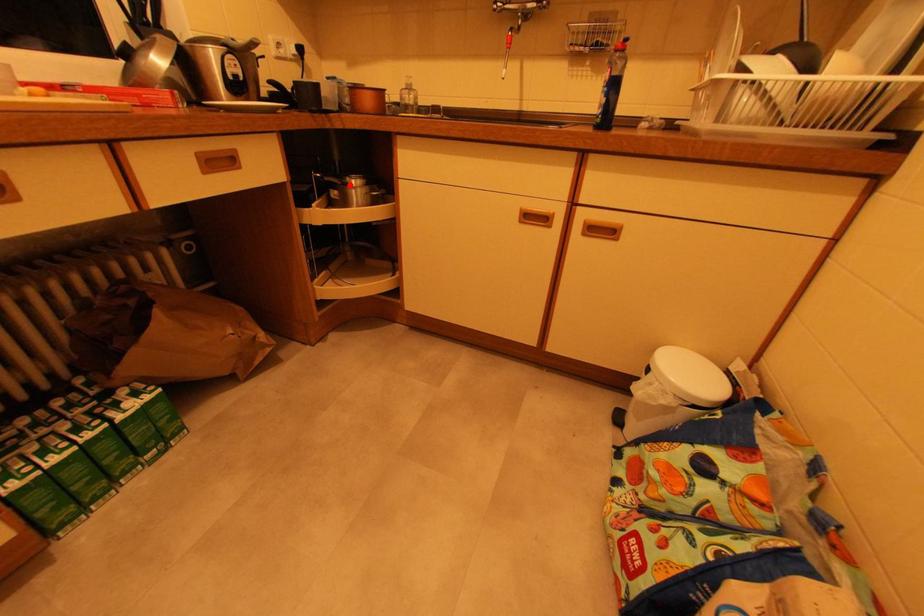
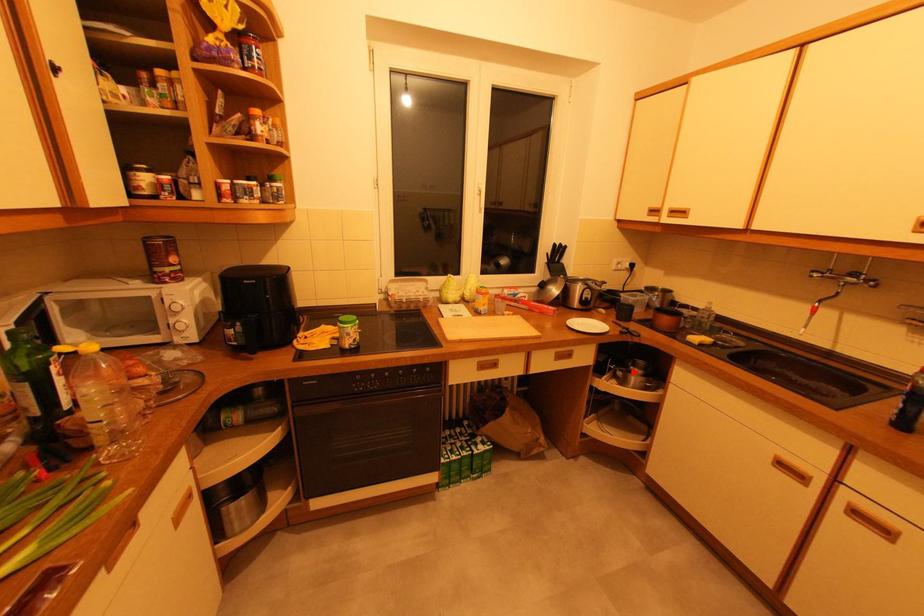
I am providing you with two images of the same scene from different viewpoints. A red point is marked on the first image and another point is marked on the second image. Do the highlighted points in image1 and image2 indicate the same real-world spot?

Yes